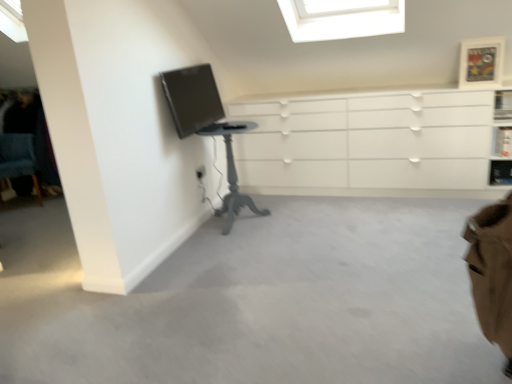
Question: From the image's perspective, is blue fabric chair at lower left above or below metallic silver shelf at upper right, arranged as the first shelf when ordered from the bottom?

Choices:
 (A) below
 (B) above

Answer: (B)

Question: From a real-world perspective, is blue fabric chair at lower left positioned above or below metallic silver shelf at upper right, which is counted as the 2th shelf, starting from the top?

Choices:
 (A) below
 (B) above

Answer: (B)

Question: Considering the real-world distances, which object is closest to the transparent glass skylight at upper center?

Choices:
 (A) white matte chest of drawers at center
 (B) metallic silver shelf at upper right, arranged as the first shelf when ordered from the bottom
 (C) matte black monitor at upper left
 (D) gray painted wood table at left
 (E) brown fabric swivel chair at lower right

Answer: (A)

Question: Estimate the real-world distances between objects in this image. Which object is farther from the metallic silver shelf at upper right, arranged as the first shelf when ordered from the bottom?

Choices:
 (A) white glossy shelf at upper right, the second shelf ordered from the bottom
 (B) gray painted wood table at left
 (C) wooden picture frame at upper right
 (D) blue fabric chair at lower left
 (E) transparent glass skylight at upper center

Answer: (D)